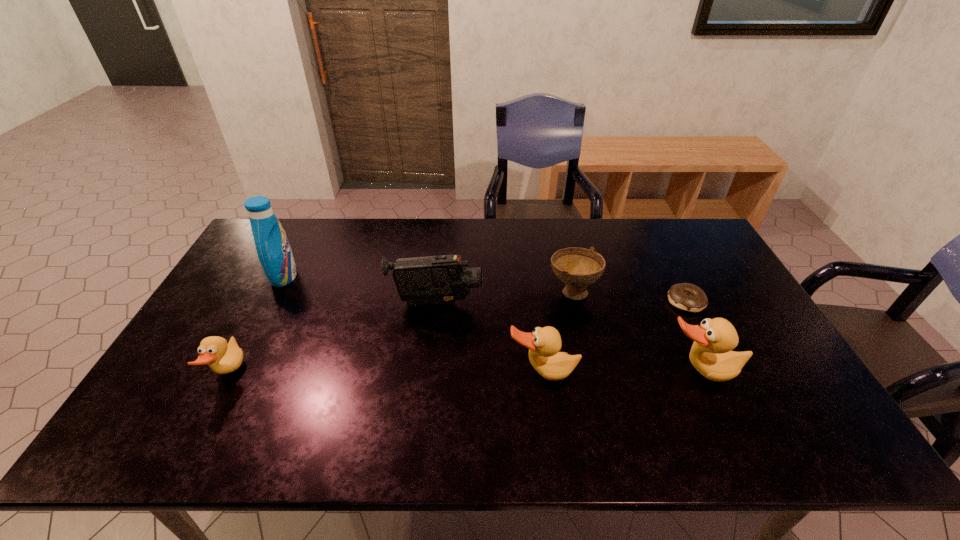
This screenshot has width=960, height=540. What are the coordinates of `vacant space situated on the front of the doughnut` in the screenshot? It's located at (702, 333).

The image size is (960, 540). I want to click on free space located on the front-facing side of the fifth object from right to left, so click(560, 303).

Identify the location of free space located 0.100m on the right of the soup bowl. The height and width of the screenshot is (540, 960). (630, 292).

Find the location of a particular element. The image size is (960, 540). duck located in the left edge section of the desktop is located at coordinates (223, 358).

You are a GUI agent. You are given a task and a screenshot of the screen. Output one action in this format:
    pyautogui.click(x=<x>, y=<y>)
    Task: Click on the detergent that is positioned at the left edge
    The image size is (960, 540).
    Given the screenshot: What is the action you would take?
    [274, 252]

Locate an element on the screen. duck present at the right edge is located at coordinates (711, 355).

Identify the location of doughnut at the right edge. (686, 296).

At what (x,y) coordinates should I click in order to perform the action: click on object that is at the near left corner. Please return your answer as a coordinate pair (x, y). The height and width of the screenshot is (540, 960). Looking at the image, I should click on (223, 358).

Find the location of `object present at the near right corner`. object present at the near right corner is located at coordinates (711, 355).

Identify the location of vacant space at the far edge of the desktop. The width and height of the screenshot is (960, 540). (602, 240).